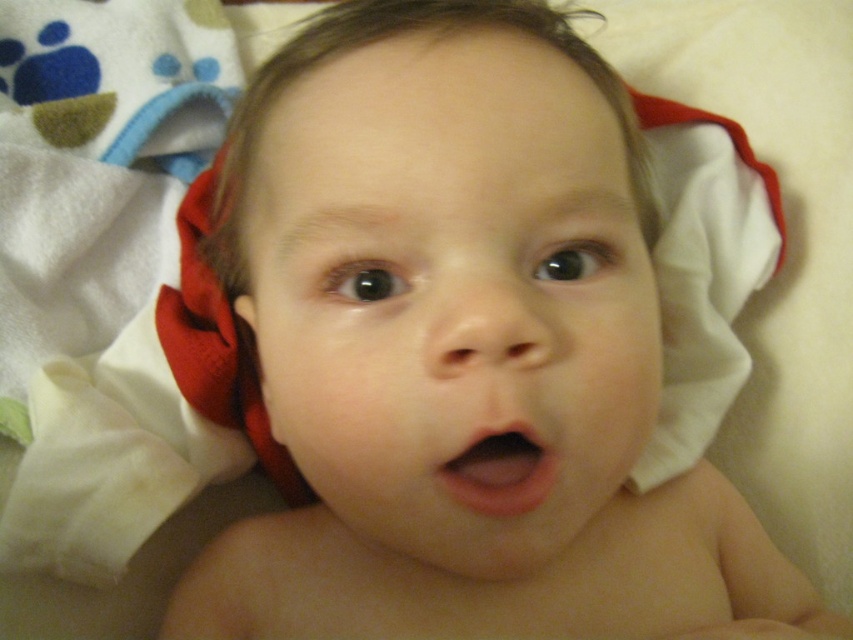
Question: Can you confirm if pink smooth flesh at center is positioned below soft fabric ear at lower left?

Choices:
 (A) yes
 (B) no

Answer: (A)

Question: Which object appears farthest from the camera in this image?

Choices:
 (A) soft fabric ear at lower left
 (B) pink smooth flesh at center

Answer: (A)

Question: Is pink smooth flesh at center wider than soft fabric ear at lower left?

Choices:
 (A) no
 (B) yes

Answer: (B)

Question: Where is pink smooth flesh at center located in relation to soft fabric ear at lower left in the image?

Choices:
 (A) below
 (B) above

Answer: (A)

Question: Which of the following is the farthest from the observer?

Choices:
 (A) (251, 397)
 (B) (473, 476)

Answer: (A)